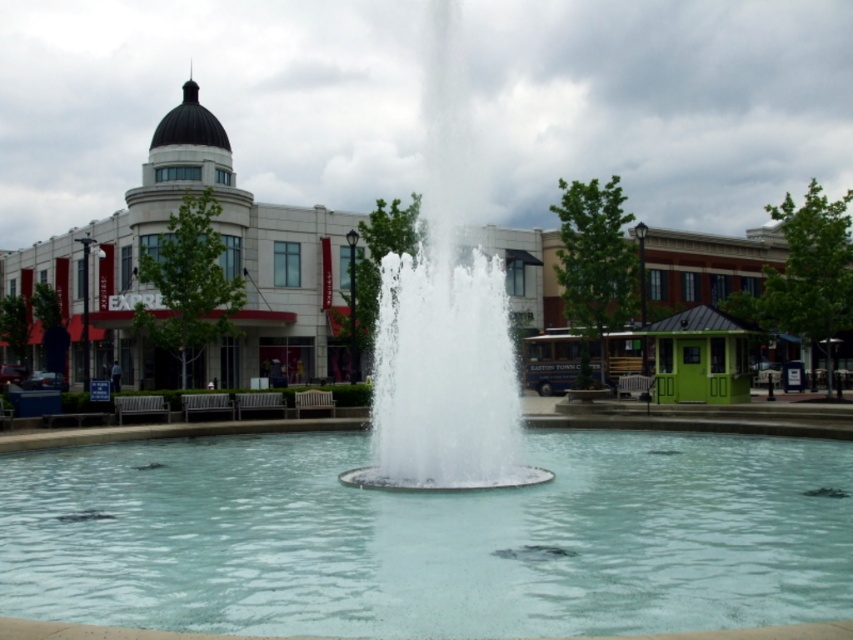
Question: Is clear glass pool at center wider than clear water fountain at center?

Choices:
 (A) no
 (B) yes

Answer: (B)

Question: Which of the following is the closest to the observer?

Choices:
 (A) (392, 518)
 (B) (352, 483)

Answer: (A)

Question: Which object appears farthest from the camera in this image?

Choices:
 (A) clear water fountain at center
 (B) clear glass pool at center

Answer: (A)

Question: Can you confirm if clear glass pool at center is wider than clear water fountain at center?

Choices:
 (A) no
 (B) yes

Answer: (B)

Question: Is clear glass pool at center behind clear water fountain at center?

Choices:
 (A) no
 (B) yes

Answer: (A)